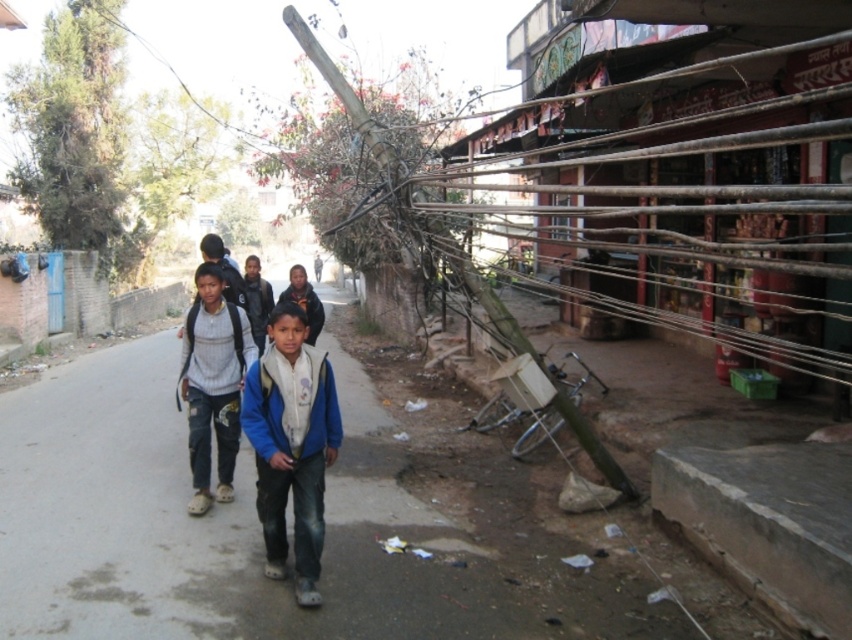
Which is in front, point (291, 481) or point (227, 353)?

Point (291, 481) is in front.

From the picture: Is blue fleece jacket at center thinner than knitted sweater at center?

Yes.

Image resolution: width=852 pixels, height=640 pixels. In order to click on blue fleece jacket at center in this screenshot , I will do click(x=291, y=444).

Where is `blue fleece jacket at center`? The height and width of the screenshot is (640, 852). blue fleece jacket at center is located at coordinates (291, 444).